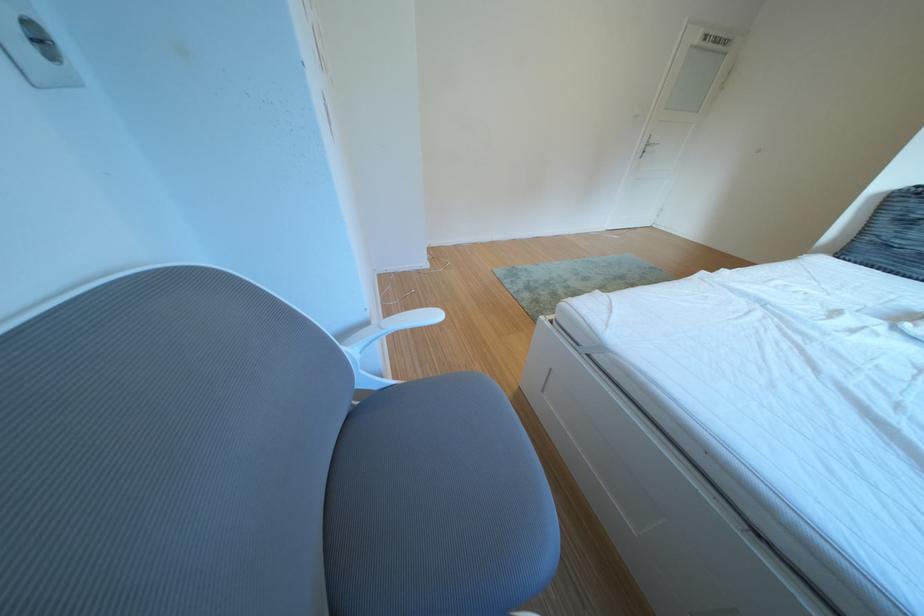
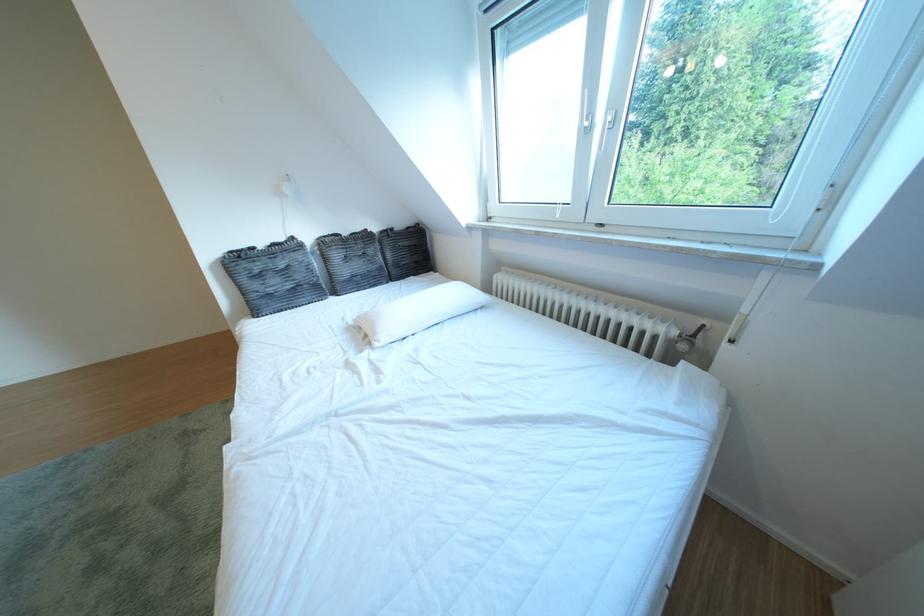
The images are taken continuously from a first-person perspective. In which direction is your viewpoint rotating?

The camera's rotation is toward right-down.